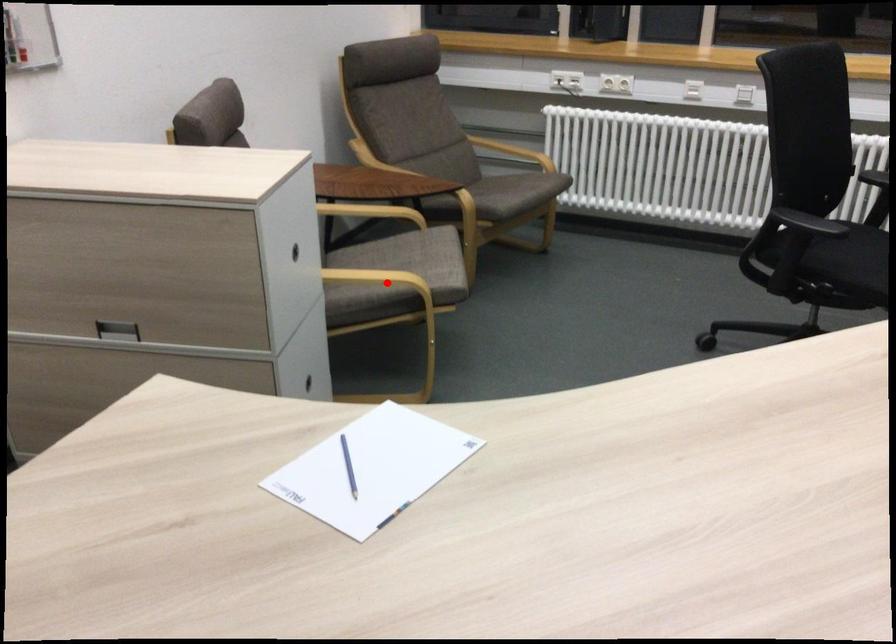
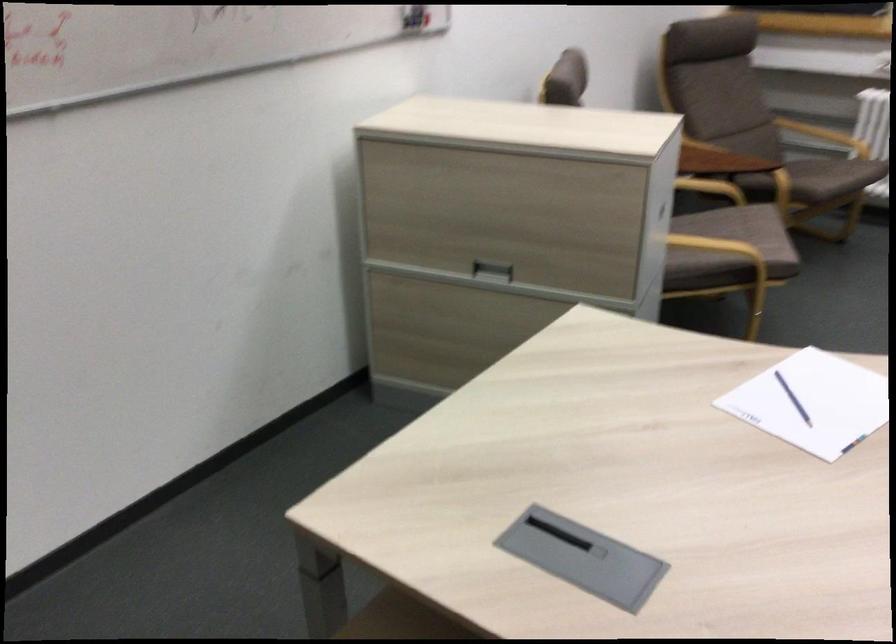
Question: I am providing you with two images of the same scene from different viewpoints. A red point is marked on the first image. Can you still see the location of the red point in image 2?

Choices:
 (A) Yes
 (B) No

Answer: (A)